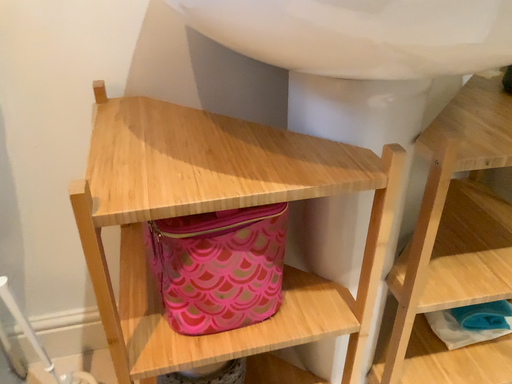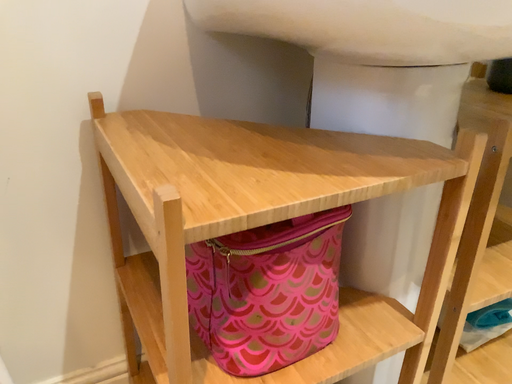
Question: How did the camera likely rotate when shooting the video?

Choices:
 (A) rotated left
 (B) rotated right

Answer: (B)